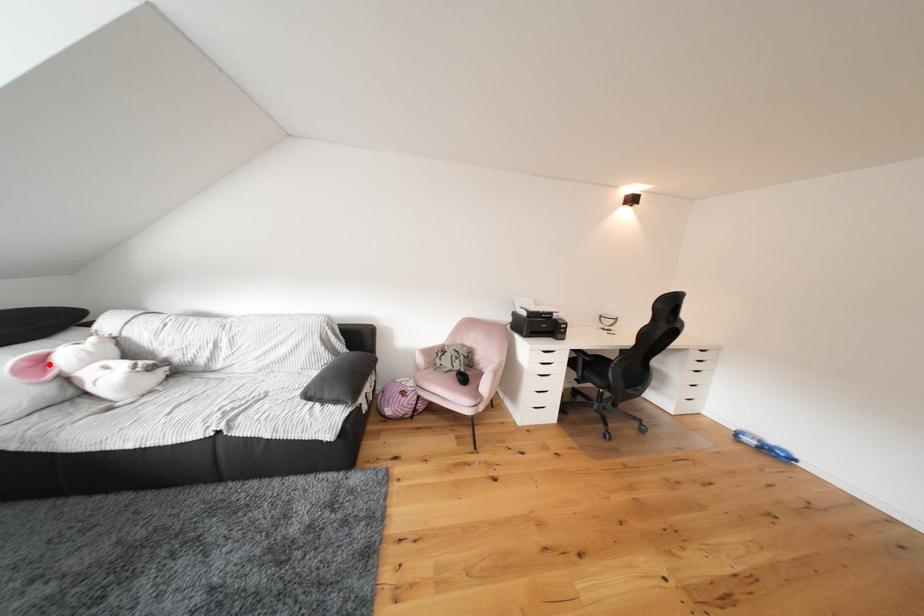
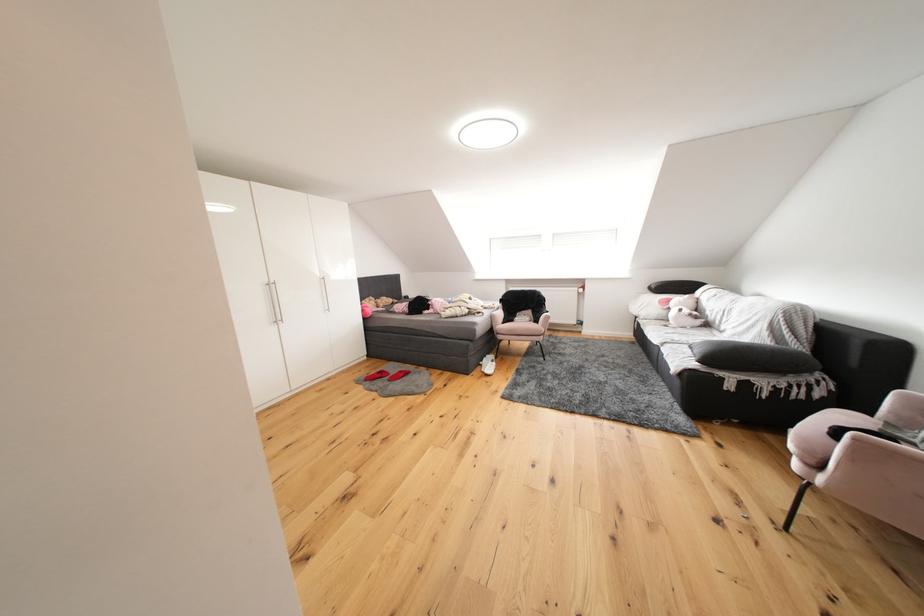
Question: I am providing you with two images of the same scene from different viewpoints. Image1 has a red point marked. In image2, the corresponding 3D location appears at what relative position? Reply with the corresponding letter.

Choices:
 (A) Closer
 (B) Farther

Answer: (A)